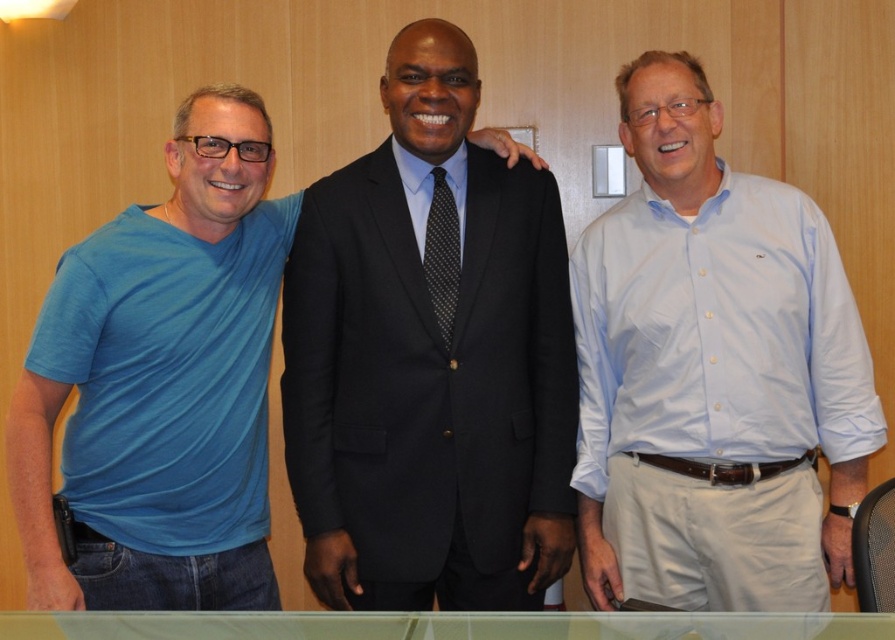
You are standing in a professional setting and want to place a small potted plant exactly at point (335, 172). If the plant has a height of 3 feet, will it be visible to someone standing 6.60 feet away from that point?

The distance between the viewer and point (335, 172) is 6.60 feet. The plant is 3 feet tall, so it will be visible to someone standing that distance away as long as there are no obstructions.

You are a photographer trying to position a spotlight on the light blue button down shirt at center. Given that the coordinate system starts at the bottom left corner of the image, with x increasing to the right and y increasing upwards, can you confirm if the point at (712, 371) is the correct location for the spotlight?

Yes, the point at (712, 371) corresponds to the light blue button down shirt at center, so placing the spotlight there would correctly illuminate it.

You are a photographer standing 5 feet away from the black wool suit at center. Can you adjust your position to get a closer shot without moving the suit?

The black wool suit at center is 6.21 feet from viewer. Since you are already 5 feet away, you can move 1.21 feet closer to get a closer shot without moving the suit.